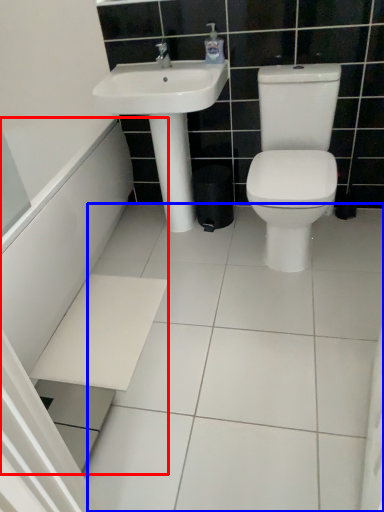
Question: Among these objects, which one is farthest to the camera, bath (highlighted by a red box) or ceramic tile (highlighted by a blue box)?

Choices:
 (A) bath
 (B) ceramic tile

Answer: (A)